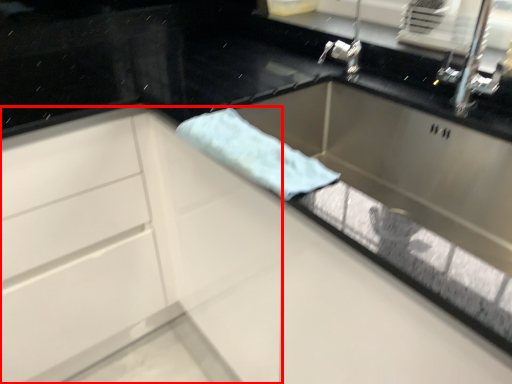
Question: Observing the image, what is the correct spatial positioning of cabinetry (annotated by the red box) in reference to beach towel?

Choices:
 (A) right
 (B) left

Answer: (B)